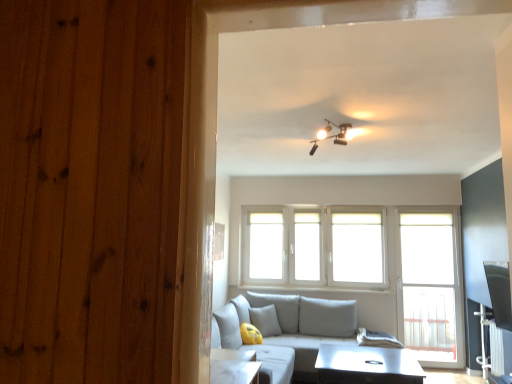
Question: Is light gray fabric couch at center taller or shorter than matte black track lights at upper center?

Choices:
 (A) short
 (B) tall

Answer: (B)

Question: From the image's perspective, is light gray fabric couch at center positioned above or below matte black track lights at upper center?

Choices:
 (A) below
 (B) above

Answer: (A)

Question: Which object is the farthest from the white glossy bay window at center?

Choices:
 (A) clear plastic screen door at right
 (B) white glossy table at center
 (C) white fabric curtain at lower right
 (D) light gray fabric couch at center
 (E) matte black track lights at upper center

Answer: (E)

Question: Considering the real-world distances, which object is farthest from the white glossy bay window at center?

Choices:
 (A) matte black track lights at upper center
 (B) yellow fabric pillow at lower center
 (C) white fabric curtain at lower right
 (D) white glossy table at center
 (E) clear plastic screen door at right

Answer: (A)